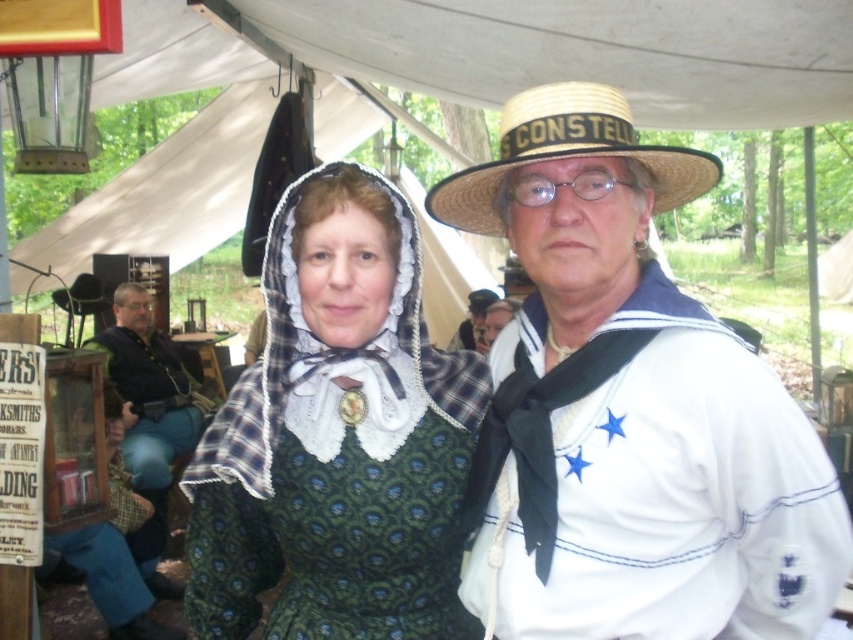
Question: Does dark blue denim pants at left appear on the left side of sailor hat at upper center?

Choices:
 (A) yes
 (B) no

Answer: (A)

Question: Which is nearer to the straw hat at center?

Choices:
 (A) sailor hat at upper center
 (B) matte green dress at center
 (C) green plaid dress at center

Answer: (B)

Question: Which object is the farthest from the sailor hat at upper center?

Choices:
 (A) dark blue denim pants at left
 (B) green plaid dress at center
 (C) matte green dress at center

Answer: (C)

Question: Is matte green dress at center positioned behind dark blue denim pants at left?

Choices:
 (A) no
 (B) yes

Answer: (A)

Question: Does green plaid dress at center appear on the right side of straw hat at center?

Choices:
 (A) yes
 (B) no

Answer: (B)

Question: Which point is farther to the camera?

Choices:
 (A) sailor hat at upper center
 (B) straw hat at center
 (C) matte green dress at center

Answer: (A)